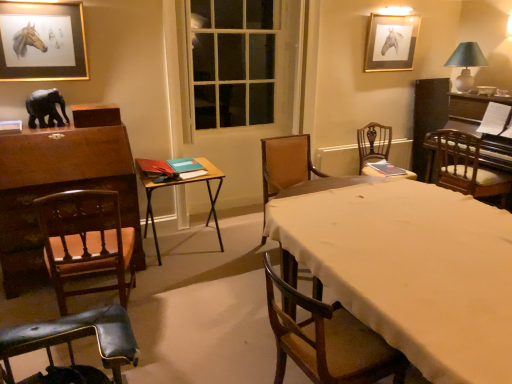
Image resolution: width=512 pixels, height=384 pixels. What are the coordinates of `gold-framed picture at upper right, marked as the 1th picture frame in a back-to-front arrangement` in the screenshot? It's located at (391, 42).

This screenshot has height=384, width=512. What do you see at coordinates (71, 346) in the screenshot? I see `leather cushioned chair at lower left, which is counted as the second chair, starting from the left` at bounding box center [71, 346].

Describe the element at coordinates (239, 62) in the screenshot. I see `clear glass window at center` at that location.

What is the approximate width of wooden folding table at center, arranged as the second table when viewed from the right?

It is 24.28 inches.

Locate an element on the screen. Image resolution: width=512 pixels, height=384 pixels. brown fabric chair at center, the 4th chair positioned from the left is located at coordinates (285, 165).

Find the location of a particular element. This screenshot has height=384, width=512. wooden chair at center, the fifth chair from the left is located at coordinates (373, 145).

Does wooden chair at center, the fourth chair in the right-to-left sequence, contain brown wood chair at left, marked as the sixth chair in a right-to-left arrangement?

No, brown wood chair at left, marked as the sixth chair in a right-to-left arrangement, is not a part of wooden chair at center, the fourth chair in the right-to-left sequence.

How distant is wooden chair at center, the fourth chair in the right-to-left sequence, from brown wood chair at left, marked as the sixth chair in a right-to-left arrangement?

1.27 meters.

Is wooden chair at center, the fourth chair in the right-to-left sequence, in front of brown wood chair at left, marked as the sixth chair in a right-to-left arrangement?

Yes, wooden chair at center, the fourth chair in the right-to-left sequence, is in front of brown wood chair at left, marked as the sixth chair in a right-to-left arrangement.

Identify the location of the 1st chair counting from the left of the wooden chair at center, the fifth chair from the left. (285, 165).

Which of these two, wooden chair at center, the fifth chair from the left, or brown fabric chair at center, the third chair viewed from the right, stands taller?

brown fabric chair at center, the third chair viewed from the right, is taller.

Considering the relative sizes of wooden chair at center, the fifth chair from the left, and brown fabric chair at center, the third chair viewed from the right, in the image provided, is wooden chair at center, the fifth chair from the left, thinner than brown fabric chair at center, the third chair viewed from the right,?

Yes, wooden chair at center, the fifth chair from the left, is thinner than brown fabric chair at center, the third chair viewed from the right.

Which chair is the 1st one when counting from the left side of the wooden chair at center, the fourth chair in the right-to-left sequence? Please provide its 2D coordinates.

[(71, 346)]

Does point (270, 296) come behind point (137, 360)?

No, it is in front of (137, 360).

Is wooden chair at center, the 3th chair positioned from the left, oriented away from leather cushioned chair at lower left, which is counted as the second chair, starting from the left?

wooden chair at center, the 3th chair positioned from the left, does not have its back to leather cushioned chair at lower left, which is counted as the second chair, starting from the left.

Does wooden chair at center, the fourth chair in the right-to-left sequence, come in front of leather cushioned chair at lower left, which appears as the 5th chair when viewed from the right?

No, wooden chair at center, the fourth chair in the right-to-left sequence, is further to the viewer.

Is black matte elephant at left far away from wooden chair at center, the 3th chair positioned from the left?

Yes.

Considering the sizes of objects black matte elephant at left and wooden chair at center, the fourth chair in the right-to-left sequence, in the image provided, who is wider, black matte elephant at left or wooden chair at center, the fourth chair in the right-to-left sequence,?

Wider between the two is wooden chair at center, the fourth chair in the right-to-left sequence.

From the image's perspective, which is above, black matte elephant at left or wooden chair at center, the 3th chair positioned from the left?

black matte elephant at left.

Does wooden folding table at center, arranged as the second table when viewed from the right, have a smaller size compared to wooden chair at center, the fifth chair from the left?

No, wooden folding table at center, arranged as the second table when viewed from the right, is not smaller than wooden chair at center, the fifth chair from the left.

Between wooden folding table at center, acting as the 1th table starting from the left, and wooden chair at center, which is counted as the 2th chair, starting from the right, which one appears on the right side from the viewer's perspective?

Positioned to the right is wooden chair at center, which is counted as the 2th chair, starting from the right.

Could you tell me if wooden folding table at center, arranged as the second table when viewed from the right, is turned towards wooden chair at center, the fifth chair from the left?

No, wooden folding table at center, arranged as the second table when viewed from the right, is not facing towards wooden chair at center, the fifth chair from the left.

From a real-world perspective, is wooden piano at right physically located above or below black matte elephant at left?

In terms of real-world spatial position, wooden piano at right is below black matte elephant at left.

Is wooden piano at right at the right side of black matte elephant at left?

Yes.

Is wooden piano at right in front of or behind black matte elephant at left in the image?

Visually, wooden piano at right is located behind black matte elephant at left.

Where is `animal that is above the wooden piano at right (from the image's perspective)`? This screenshot has width=512, height=384. animal that is above the wooden piano at right (from the image's perspective) is located at coordinates (45, 108).

Is there a large distance between clear glass window at center and black matte elephant at left?

Indeed, clear glass window at center is not near black matte elephant at left.

Is clear glass window at center inside the boundaries of black matte elephant at left, or outside?

clear glass window at center is not inside black matte elephant at left, it's outside.

How different are the orientations of clear glass window at center and black matte elephant at left in degrees?

They differ by 0.25 degrees in their facing directions.

Does point (201, 6) lie behind point (42, 106)?

That is True.

The height and width of the screenshot is (384, 512). I want to click on chair that is the 1st object located behind the wooden chair at center, the fourth chair in the right-to-left sequence, so click(x=85, y=241).

Starting from the brown fabric chair at center, the third chair viewed from the right, which chair is the 1st one to the right? Please provide its 2D coordinates.

[(373, 145)]

Estimate the real-world distances between objects in this image. Which object is closer to brown fabric chair at center, the third chair viewed from the right, wooden chair at center, the fifth chair from the left, or wooden piano at right?

Based on the image, wooden chair at center, the fifth chair from the left, appears to be nearer to brown fabric chair at center, the third chair viewed from the right.

Considering their positions, is wooden piano at right positioned closer to brown fabric chair at center, the third chair viewed from the right, than green fabric lampshade at upper right?

wooden piano at right lies closer to brown fabric chair at center, the third chair viewed from the right, than the other object.

Consider the image. Looking at the image, which one is located further to brown fabric chair at center, the 4th chair positioned from the left, clear glass window at center or wooden folding table at center, acting as the 1th table starting from the left?

Based on the image, clear glass window at center appears to be further to brown fabric chair at center, the 4th chair positioned from the left.

Based on their spatial positions, is green fabric lampshade at upper right or gold-framed picture at upper right, marked as the 1th picture frame in a back-to-front arrangement, closer to gold-framed painting of horse at upper left, positioned as the second picture frame in right-to-left order?

Among the two, gold-framed picture at upper right, marked as the 1th picture frame in a back-to-front arrangement, is located nearer to gold-framed painting of horse at upper left, positioned as the second picture frame in right-to-left order.

Which object lies nearer to the anchor point wooden piano at right, green fabric lampshade at upper right or wooden chair with cushion at right, which ranks as the first chair in right-to-left order?

wooden chair with cushion at right, which ranks as the first chair in right-to-left order, is positioned closer to the anchor wooden piano at right.

From the image, which object appears to be nearer to brown fabric chair at center, the third chair viewed from the right, wooden piano at right or wooden chair at center, which is counted as the 2th chair, starting from the right?

wooden chair at center, which is counted as the 2th chair, starting from the right, lies closer to brown fabric chair at center, the third chair viewed from the right, than the other object.

Which object lies further to the anchor point black matte elephant at left, leather cushioned chair at lower left, which appears as the 5th chair when viewed from the right, or brown fabric chair at center, the third chair viewed from the right?

Based on the image, brown fabric chair at center, the third chair viewed from the right, appears to be further to black matte elephant at left.

When comparing their distances from gold-framed painting of horse at upper left, acting as the first picture frame starting from the front, does wooden folding table at center, arranged as the second table when viewed from the right, or black matte elephant at left seem further?

wooden folding table at center, arranged as the second table when viewed from the right, lies further to gold-framed painting of horse at upper left, acting as the first picture frame starting from the front, than the other object.

Where is `table between gold-framed painting of horse at upper left, acting as the first picture frame starting from the front, and clear glass window at center, in the horizontal direction`? The width and height of the screenshot is (512, 384). table between gold-framed painting of horse at upper left, acting as the first picture frame starting from the front, and clear glass window at center, in the horizontal direction is located at coordinates (179, 184).

Find the location of a particular element. table located between wooden folding table at center, acting as the 1th table starting from the left, and wooden piano at right in the left-right direction is located at coordinates (410, 268).

In order to click on lamp between gold-framed picture at upper right, which is the second picture frame in front-to-back order, and wooden chair at center, which is counted as the 2th chair, starting from the right, from top to bottom in this screenshot , I will do `click(466, 64)`.

Locate an element on the screen. This screenshot has width=512, height=384. picture frame between brown wood chair at left, marked as the sixth chair in a right-to-left arrangement, and green fabric lampshade at upper right is located at coordinates (391, 42).